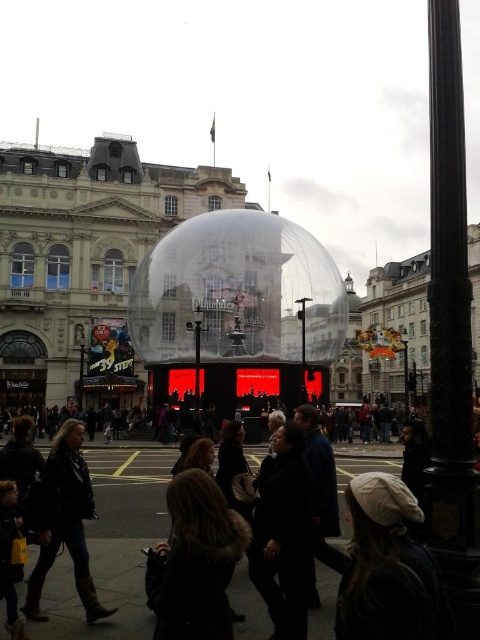
Who is positioned more to the right, transparent plastic bubble at center or dark brown fur coat at lower center?

Positioned to the right is transparent plastic bubble at center.

Is transparent plastic bubble at center behind dark brown fur coat at lower center?

Yes, it is behind dark brown fur coat at lower center.

Does point (294, 262) come farther from viewer compared to point (212, 536)?

Yes.

This screenshot has height=640, width=480. I want to click on transparent plastic bubble at center, so click(x=238, y=291).

Consider the image. Does white fabric hat at lower right have a greater width compared to dark brown fur coat at lower center?

In fact, white fabric hat at lower right might be narrower than dark brown fur coat at lower center.

How far apart are white fabric hat at lower right and dark brown fur coat at lower center?

They are 29.60 feet apart.

Is point (414, 584) positioned behind point (155, 592)?

No, (414, 584) is closer to viewer.

Image resolution: width=480 pixels, height=640 pixels. What are the coordinates of `white fabric hat at lower right` in the screenshot? It's located at (386, 566).

Who is positioned more to the right, dark brown fur coat at lower center or dark brown leather jacket at lower left?

dark brown fur coat at lower center

Looking at this image, is dark brown fur coat at lower center below dark brown leather jacket at lower left?

Yes, dark brown fur coat at lower center is below dark brown leather jacket at lower left.

Is point (219, 525) positioned before point (72, 464)?

Yes, it is.

Where is `dark brown fur coat at lower center`? The image size is (480, 640). dark brown fur coat at lower center is located at coordinates (194, 561).